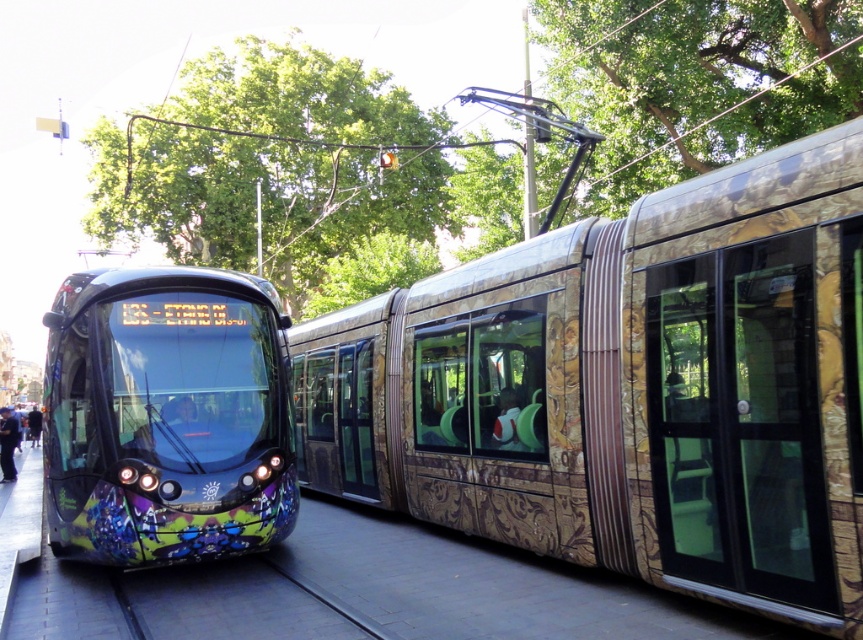
You are standing on the sidewalk next to the tram tracks and see the point at coordinates (628, 388). What object is located at that point?

The point at coordinates (628, 388) indicates the gold patterned tram at center.